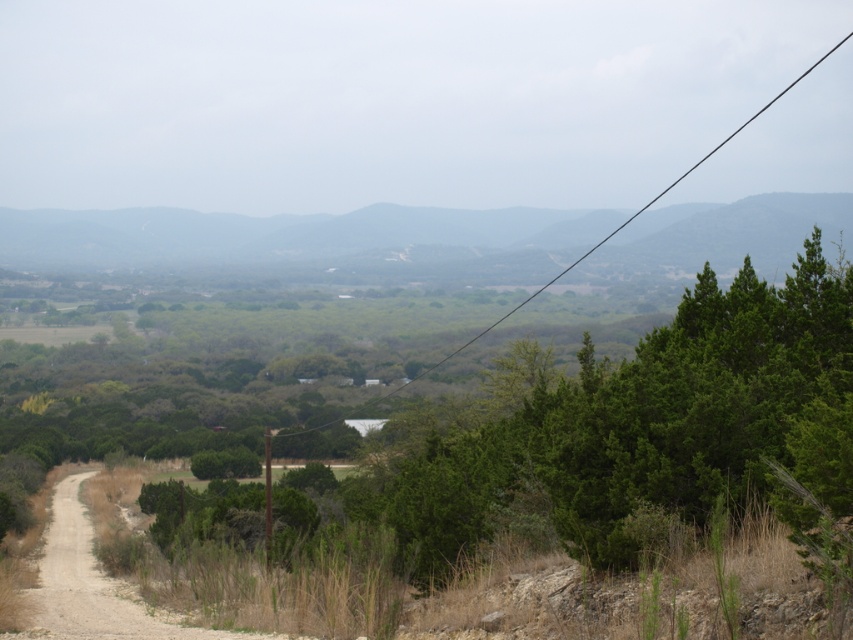
Which of these two, green leafy tree at center or green grassy hill at center, stands shorter?

With less height is green leafy tree at center.

Does green leafy tree at center have a lesser height compared to green grassy hill at center?

Correct, green leafy tree at center is not as tall as green grassy hill at center.

Is point (645, 461) farther from camera compared to point (692, 234)?

No.

Locate an element on the screen. Image resolution: width=853 pixels, height=640 pixels. green leafy tree at center is located at coordinates (640, 429).

Is green grassy hill at center to the right of black wire at upper center from the viewer's perspective?

Incorrect, green grassy hill at center is not on the right side of black wire at upper center.

Who is more forward, (347, 269) or (412, 380)?

Point (412, 380) is in front.

Between point (576, 236) and point (844, 36), which one is positioned in front?

Positioned in front is point (576, 236).

Where is `green grassy hill at center`? green grassy hill at center is located at coordinates (305, 241).

Is green leafy tree at center to the right of black wire at upper center from the viewer's perspective?

Incorrect, green leafy tree at center is not on the right side of black wire at upper center.

Who is taller, green leafy tree at center or black wire at upper center?

black wire at upper center is taller.

Who is more distant from viewer, (584, 486) or (648, 204)?

Point (648, 204)

Locate an element on the screen. This screenshot has width=853, height=640. green leafy tree at center is located at coordinates (640, 429).